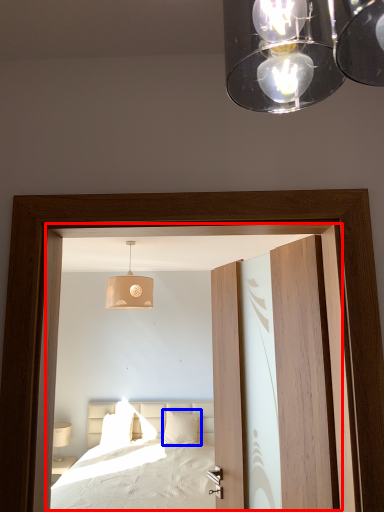
Question: Which of the following is the closest to the observer, window (highlighted by a red box) or pillow (highlighted by a blue box)?

Choices:
 (A) window
 (B) pillow

Answer: (A)